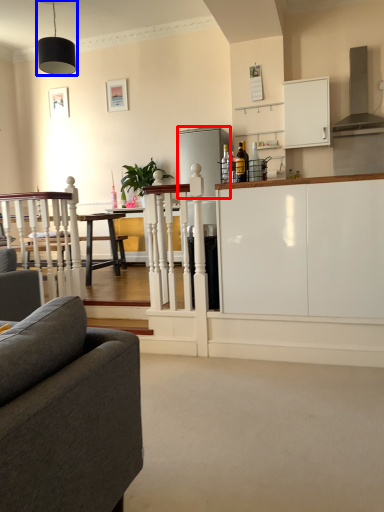
Question: Which point is further to the camera, appliance (highlighted by a red box) or light fixture (highlighted by a blue box)?

Choices:
 (A) appliance
 (B) light fixture

Answer: (A)